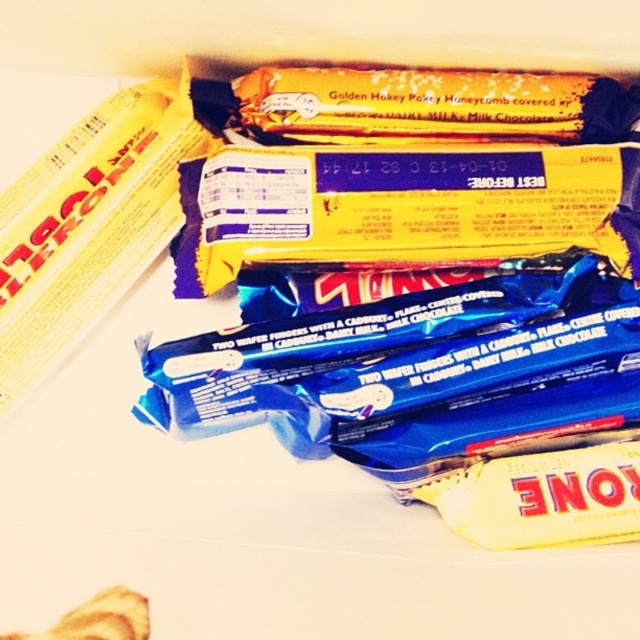
You are organizing a party and need to place the yellow matte chocolate bar at center and the golden honeycomb at upper center on a shelf. Which one should you place first to ensure they both fit properly?

The yellow matte chocolate bar at center is larger than the golden honeycomb at upper center, so you should place the yellow matte chocolate bar at center first to ensure there is enough space for both items on the shelf.

You are a customer at a store looking at the Cadbury chocolates. You want to know which chocolate is taller between the yellow matte chocolate bar at center and the golden honeycomb at upper center. Can you tell me which one is taller?

The yellow matte chocolate bar at center is much taller than the golden honeycomb at upper center.

You are arranging Cadbury chocolates on a table. You have a yellow matte chocolate bar at center and a golden honeycomb at upper center. Which one is closer to you?

The yellow matte chocolate bar at center is closer to you than the golden honeycomb at upper center.